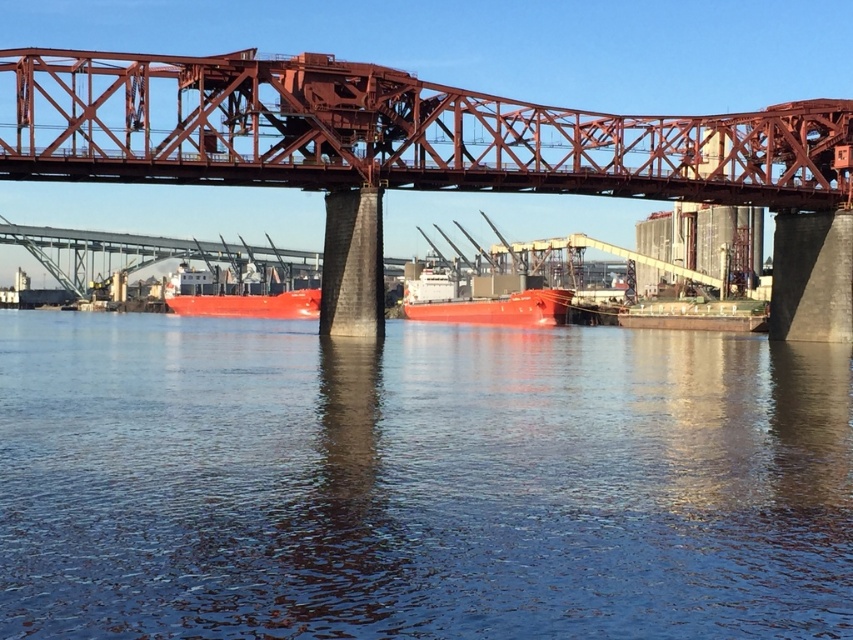
Question: Does red steel bridge at center appear on the left side of smooth matte red ship at center?

Choices:
 (A) no
 (B) yes

Answer: (B)

Question: Can you confirm if glossy water at center is bigger than red steel bridge at center?

Choices:
 (A) yes
 (B) no

Answer: (B)

Question: Among these objects, which one is nearest to the camera?

Choices:
 (A) smooth matte red ship at center
 (B) red steel bridge at center
 (C) glossy water at center

Answer: (C)

Question: Which point is farther to the camera?

Choices:
 (A) (828, 476)
 (B) (751, 195)

Answer: (B)

Question: Which point appears farthest from the camera in this image?

Choices:
 (A) (718, 433)
 (B) (556, 308)

Answer: (B)

Question: Does smooth matte red ship at center have a larger size compared to smooth red ship at center?

Choices:
 (A) no
 (B) yes

Answer: (B)